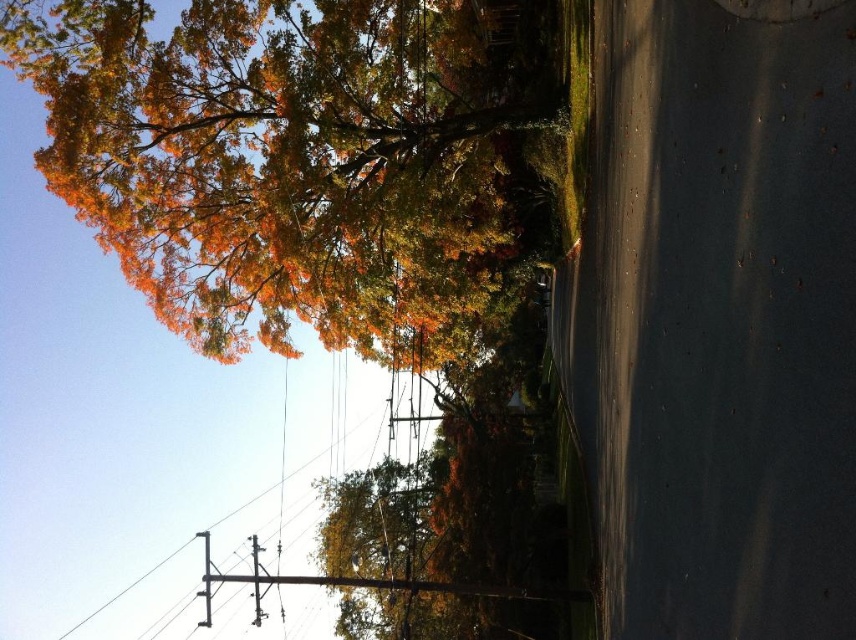
Question: Which of these objects is positioned farthest from the autumn leaves at upper left?

Choices:
 (A) metallic gray telegraph pole at center-left
 (B) metallic gray telegraph pole at center

Answer: (A)

Question: Which point is closer to the camera?

Choices:
 (A) (253, 234)
 (B) (253, 538)

Answer: (A)

Question: Can you confirm if metallic gray telegraph pole at center-left is bigger than metallic gray telegraph pole at center?

Choices:
 (A) yes
 (B) no

Answer: (A)

Question: Does metallic gray telegraph pole at center-left have a larger size compared to metallic gray telegraph pole at center?

Choices:
 (A) no
 (B) yes

Answer: (B)

Question: Which object appears farthest from the camera in this image?

Choices:
 (A) metallic gray telegraph pole at center
 (B) autumn leaves at upper left
 (C) metallic gray telegraph pole at center-left

Answer: (A)

Question: Is metallic gray telegraph pole at center-left above metallic gray telegraph pole at center?

Choices:
 (A) no
 (B) yes

Answer: (A)